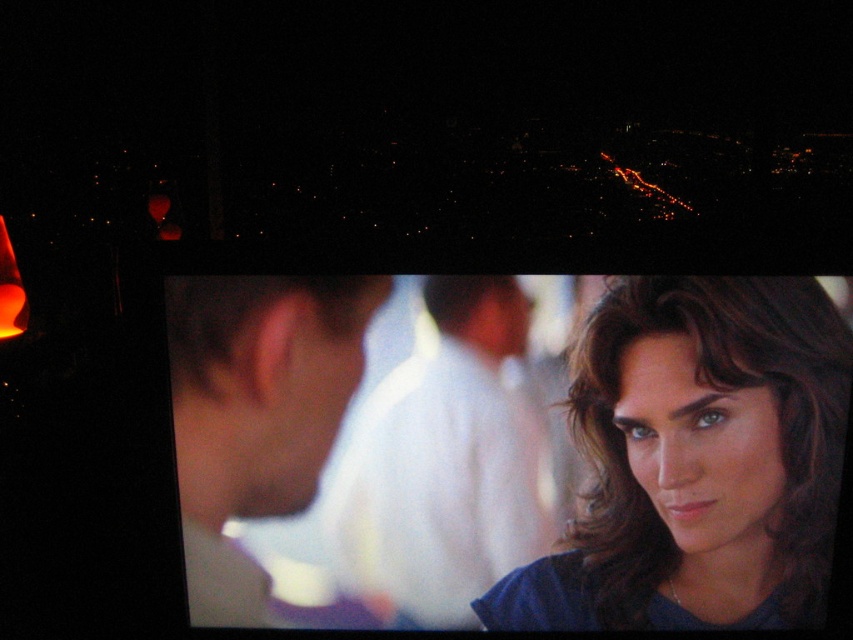
Question: Where is white cotton shirt at center located in relation to smooth skin face at center in the image?

Choices:
 (A) above
 (B) below

Answer: (B)

Question: Which point is farther from the camera taking this photo?

Choices:
 (A) (784, 556)
 (B) (263, 356)
 (C) (334, 536)

Answer: (C)

Question: Considering the real-world distances, which object is farthest from the smooth skin face at center?

Choices:
 (A) matte blue shirt at center
 (B) white cotton shirt at center

Answer: (A)

Question: Is matte blue shirt at center wider than white cotton shirt at center?

Choices:
 (A) no
 (B) yes

Answer: (B)

Question: Is white cotton shirt at center above smooth skin face at center?

Choices:
 (A) yes
 (B) no

Answer: (B)

Question: Which is nearer to the smooth skin face at center?

Choices:
 (A) white cotton shirt at center
 (B) matte blue shirt at center

Answer: (A)